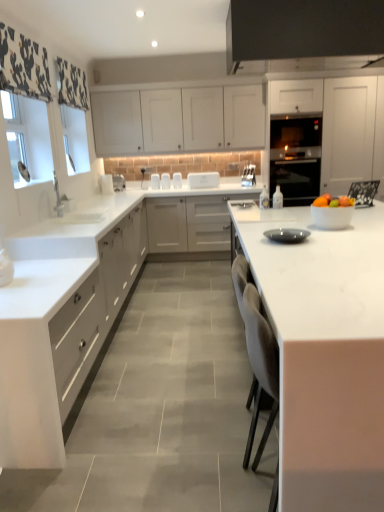
The height and width of the screenshot is (512, 384). Identify the location of vacant area that lies in front of matte gray plate at center, the 2th appliance when ordered from left to right. (302, 249).